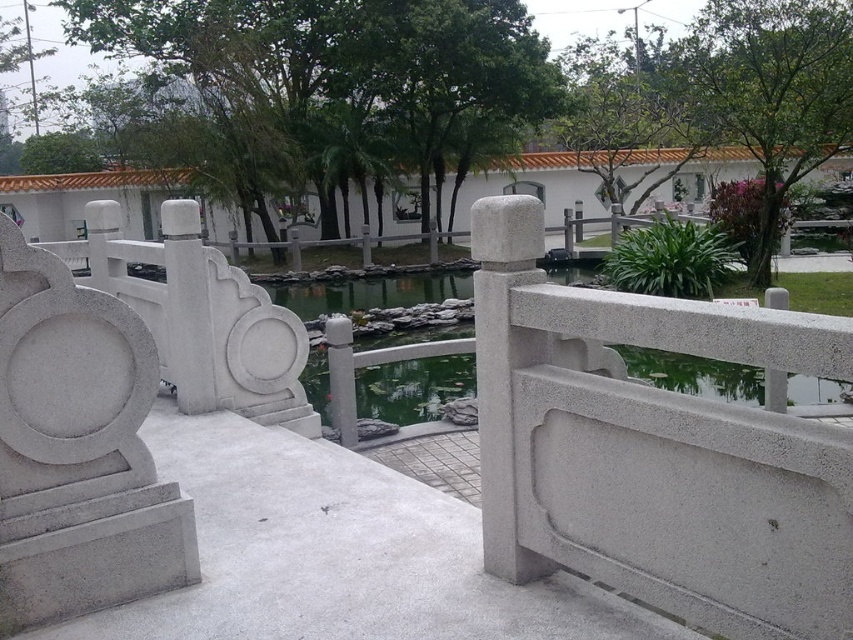
Is gray stone railing at center closer to the viewer compared to white stone railing at left?

Yes, gray stone railing at center is closer to the viewer.

This screenshot has width=853, height=640. I want to click on gray stone railing at center, so click(x=337, y=554).